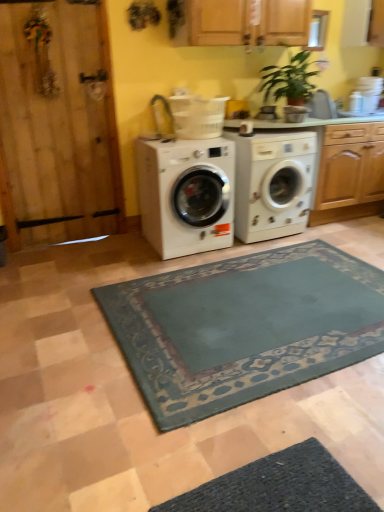
The image size is (384, 512). What are the coordinates of `white glossy washing machine at center, the first washing machine from the right` in the screenshot? It's located at coord(272,183).

What do you see at coordinates (272, 183) in the screenshot?
I see `white glossy washing machine at center, which is the second washing machine from left to right` at bounding box center [272, 183].

I want to click on white glossy washing machine at center, placed as the first washing machine when sorted from left to right, so tap(186, 194).

The image size is (384, 512). What do you see at coordinates (186, 194) in the screenshot?
I see `white glossy washing machine at center, which ranks as the 2th washing machine in right-to-left order` at bounding box center [186, 194].

You are a GUI agent. You are given a task and a screenshot of the screen. Output one action in this format:
    pyautogui.click(x=<x>, y=<y>)
    Task: Click on the white glossy washing machine at center, which is the second washing machine from left to right
    
    Given the screenshot: What is the action you would take?
    pyautogui.click(x=272, y=183)

Can you confirm if white glossy washing machine at center, which ranks as the 2th washing machine in right-to-left order, is positioned to the left of white glossy washing machine at center, which is the second washing machine from left to right?

Yes.

Is white glossy washing machine at center, which ranks as the 2th washing machine in right-to-left order, positioned before white glossy washing machine at center, which is the second washing machine from left to right?

Yes, it is in front of white glossy washing machine at center, which is the second washing machine from left to right.

Which is in front, point (151, 223) or point (262, 202)?

The point (151, 223) is closer.

From the image's perspective, relative to white glossy washing machine at center, which is the second washing machine from left to right, is white glossy washing machine at center, which ranks as the 2th washing machine in right-to-left order, above or below?

white glossy washing machine at center, which ranks as the 2th washing machine in right-to-left order, is below white glossy washing machine at center, which is the second washing machine from left to right.

From a real-world perspective, is white glossy washing machine at center, which ranks as the 2th washing machine in right-to-left order, above or below white glossy washing machine at center, which is the second washing machine from left to right?

white glossy washing machine at center, which ranks as the 2th washing machine in right-to-left order, is above white glossy washing machine at center, which is the second washing machine from left to right.

In terms of width, does white glossy washing machine at center, placed as the first washing machine when sorted from left to right, look wider or thinner when compared to white glossy washing machine at center, which is the second washing machine from left to right?

Considering their sizes, white glossy washing machine at center, placed as the first washing machine when sorted from left to right, looks broader than white glossy washing machine at center, which is the second washing machine from left to right.

Is white glossy washing machine at center, placed as the first washing machine when sorted from left to right, shorter than white glossy washing machine at center, the first washing machine from the right?

Correct, white glossy washing machine at center, placed as the first washing machine when sorted from left to right, is not as tall as white glossy washing machine at center, the first washing machine from the right.

In the scene shown: Considering the sizes of objects white glossy washing machine at center, which ranks as the 2th washing machine in right-to-left order, and white glossy washing machine at center, which is the second washing machine from left to right, in the image provided, who is bigger, white glossy washing machine at center, which ranks as the 2th washing machine in right-to-left order, or white glossy washing machine at center, which is the second washing machine from left to right,?

white glossy washing machine at center, which ranks as the 2th washing machine in right-to-left order, is bigger.

Consider the image. Is white glossy washing machine at center, which ranks as the 2th washing machine in right-to-left order, spatially inside white glossy washing machine at center, the first washing machine from the right, or outside of it?

white glossy washing machine at center, which ranks as the 2th washing machine in right-to-left order, is located beyond the bounds of white glossy washing machine at center, the first washing machine from the right.

Is white glossy washing machine at center, which ranks as the 2th washing machine in right-to-left order, not close to white glossy washing machine at center, the first washing machine from the right?

white glossy washing machine at center, which ranks as the 2th washing machine in right-to-left order, is near white glossy washing machine at center, the first washing machine from the right, not far away.

Is white glossy washing machine at center, which ranks as the 2th washing machine in right-to-left order, looking in the opposite direction of white glossy washing machine at center, the first washing machine from the right?

No, white glossy washing machine at center, which ranks as the 2th washing machine in right-to-left order,'s orientation is not away from white glossy washing machine at center, the first washing machine from the right.

I want to click on washing machine in front of the white glossy washing machine at center, the first washing machine from the right, so click(186, 194).

Based on their positions, is white glossy washing machine at center, which is the second washing machine from left to right, located to the left or right of white glossy washing machine at center, which ranks as the 2th washing machine in right-to-left order?

white glossy washing machine at center, which is the second washing machine from left to right, is to the right of white glossy washing machine at center, which ranks as the 2th washing machine in right-to-left order.

Which object is more forward, white glossy washing machine at center, which is the second washing machine from left to right, or white glossy washing machine at center, which ranks as the 2th washing machine in right-to-left order?

white glossy washing machine at center, which ranks as the 2th washing machine in right-to-left order, is in front.

Is point (238, 184) positioned behind point (185, 186)?

Yes, point (238, 184) is behind point (185, 186).

From the image's perspective, which object appears higher, white glossy washing machine at center, which is the second washing machine from left to right, or white glossy washing machine at center, placed as the first washing machine when sorted from left to right?

From the image's view, white glossy washing machine at center, which is the second washing machine from left to right, is above.

From a real-world perspective, is white glossy washing machine at center, which is the second washing machine from left to right, positioned under white glossy washing machine at center, which ranks as the 2th washing machine in right-to-left order, based on gravity?

Indeed, from a real-world perspective, white glossy washing machine at center, which is the second washing machine from left to right, is positioned beneath white glossy washing machine at center, which ranks as the 2th washing machine in right-to-left order.

Which object is thinner, white glossy washing machine at center, which is the second washing machine from left to right, or white glossy washing machine at center, which ranks as the 2th washing machine in right-to-left order?

white glossy washing machine at center, which is the second washing machine from left to right, is thinner.

Looking at this image, considering the relative sizes of white glossy washing machine at center, the first washing machine from the right, and white glossy washing machine at center, placed as the first washing machine when sorted from left to right, in the image provided, is white glossy washing machine at center, the first washing machine from the right, shorter than white glossy washing machine at center, placed as the first washing machine when sorted from left to right,?

No.

In terms of size, does white glossy washing machine at center, which is the second washing machine from left to right, appear bigger or smaller than white glossy washing machine at center, which ranks as the 2th washing machine in right-to-left order?

white glossy washing machine at center, which is the second washing machine from left to right, is smaller than white glossy washing machine at center, which ranks as the 2th washing machine in right-to-left order.

Is white glossy washing machine at center, which is the second washing machine from left to right, outside of white glossy washing machine at center, which ranks as the 2th washing machine in right-to-left order?

white glossy washing machine at center, which is the second washing machine from left to right, lies outside white glossy washing machine at center, which ranks as the 2th washing machine in right-to-left order,'s area.

In the scene shown: Is white glossy washing machine at center, the first washing machine from the right, not near white glossy washing machine at center, which ranks as the 2th washing machine in right-to-left order?

No, white glossy washing machine at center, the first washing machine from the right, is not far away from white glossy washing machine at center, which ranks as the 2th washing machine in right-to-left order.

Is white glossy washing machine at center, which is the second washing machine from left to right, facing away from white glossy washing machine at center, which ranks as the 2th washing machine in right-to-left order?

No.

Consider the image. How many degrees apart are the facing directions of white glossy washing machine at center, the first washing machine from the right, and white glossy washing machine at center, which ranks as the 2th washing machine in right-to-left order?

There is a 0.000439-degree angle between the facing directions of white glossy washing machine at center, the first washing machine from the right, and white glossy washing machine at center, which ranks as the 2th washing machine in right-to-left order.

Identify the location of washing machine located above the white glossy washing machine at center, which ranks as the 2th washing machine in right-to-left order (from the image's perspective). The height and width of the screenshot is (512, 384). (272, 183).

Where is `washing machine that appears below the white glossy washing machine at center, which is the second washing machine from left to right (from the image's perspective)`? The height and width of the screenshot is (512, 384). washing machine that appears below the white glossy washing machine at center, which is the second washing machine from left to right (from the image's perspective) is located at coordinates (186, 194).

In the image, there is a white glossy washing machine at center, placed as the first washing machine when sorted from left to right. At what (x,y) coordinates should I click in order to perform the action: click on washing machine below it (from a real-world perspective). Please return your answer as a coordinate pair (x, y). Looking at the image, I should click on [x=272, y=183].